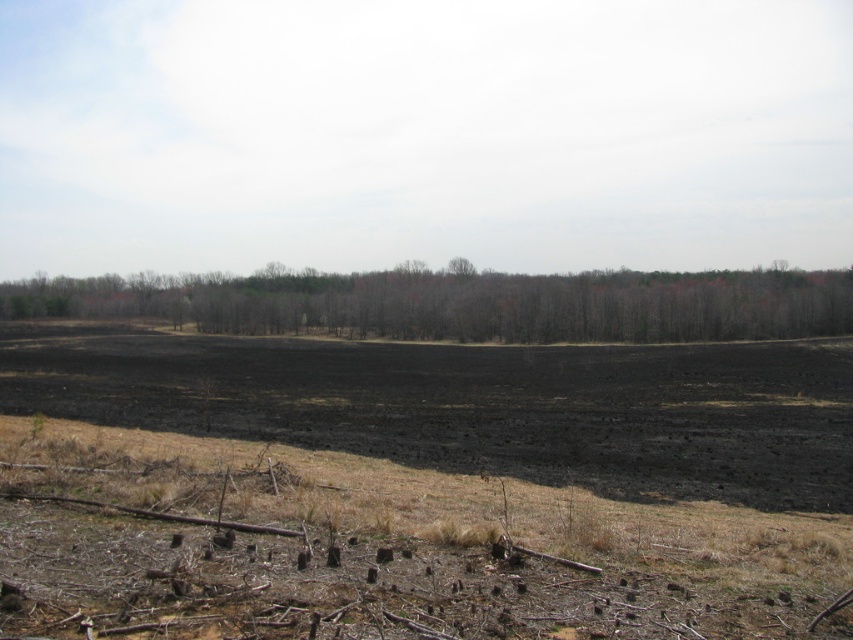
Question: From the image, what is the correct spatial relationship of black soil at center in relation to brown/dry wood at center?

Choices:
 (A) above
 (B) below

Answer: (B)

Question: Which point is farther to the camera?

Choices:
 (A) (227, 323)
 (B) (772, 436)

Answer: (A)

Question: In this image, where is black soil at center located relative to brown/dry wood at center?

Choices:
 (A) above
 (B) below

Answer: (B)

Question: Is black soil at center further to camera compared to brown/dry wood at center?

Choices:
 (A) no
 (B) yes

Answer: (A)

Question: Which of the following is the farthest from the observer?

Choices:
 (A) brown/dry wood at center
 (B) black soil at center

Answer: (A)